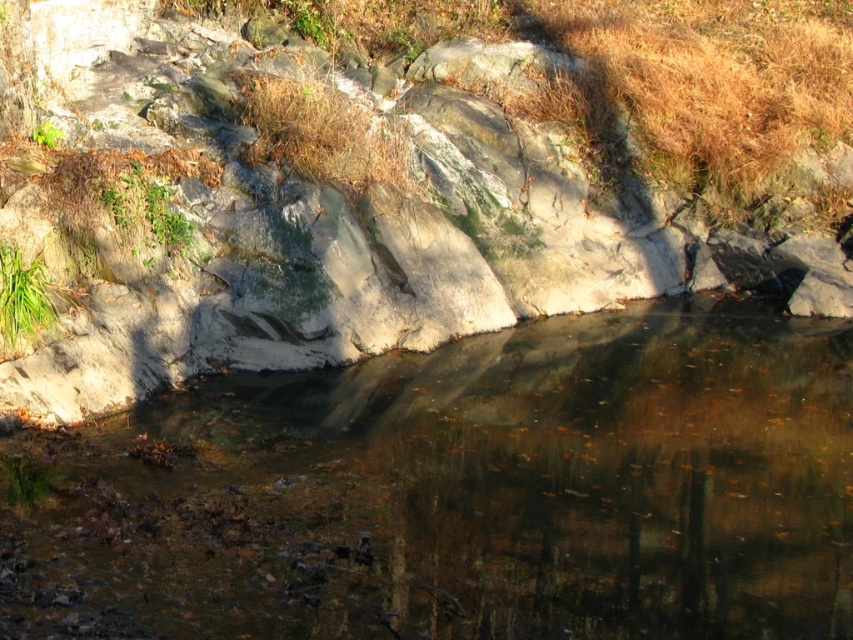
Based on the scene description, can you determine if the water at point [460,492] is clear or murky?

The water at point [460,492] is clear.

You are a hiker who wants to cross the stream safely. You see the rough stone hillside at upper center and the green grass at lower left. Which area would provide a more stable footing for crossing the stream?

The rough stone hillside at upper center has a larger size compared to the green grass at lower left, so it would provide a more stable footing for crossing the stream.

You are standing at the edge of the rocky area near the water. There are two points marked in the scene. The first point is at coordinates point (451,538) and the second is at point (24,321). Which of these two points is nearer to you?

Point (451,538) is closer to the viewer than point (24,321), so the first point is nearer to you.